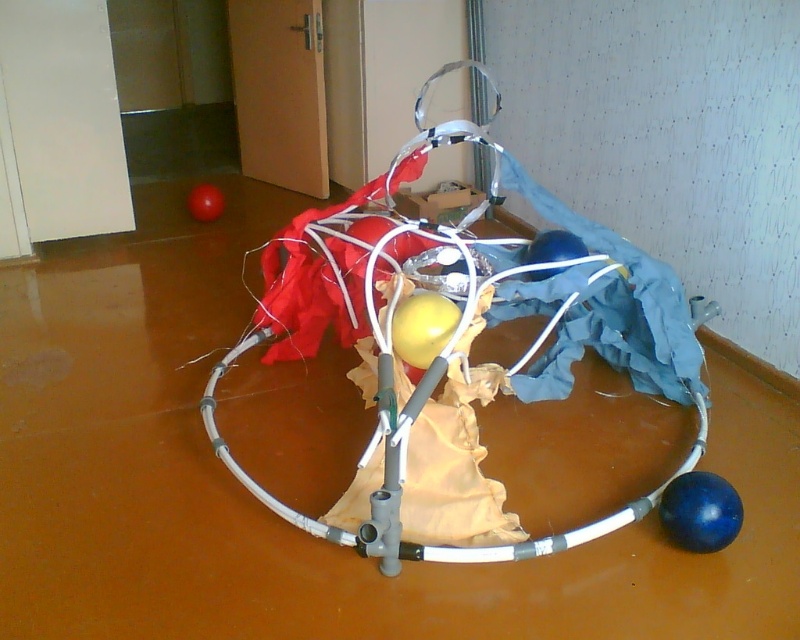
Question: Which point is farther to the camera?

Choices:
 (A) (718, 476)
 (B) (545, 548)

Answer: (A)

Question: Is metallic wire frame at center positioned in front of blue rubber ball at lower right?

Choices:
 (A) no
 (B) yes

Answer: (B)

Question: Does metallic wire frame at center have a greater width compared to blue rubber ball at lower right?

Choices:
 (A) no
 (B) yes

Answer: (B)

Question: Can you confirm if metallic wire frame at center is thinner than blue rubber ball at lower right?

Choices:
 (A) yes
 (B) no

Answer: (B)